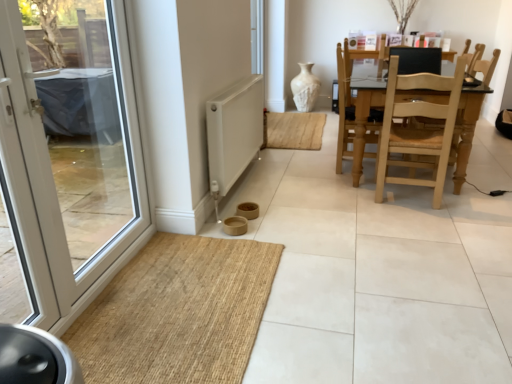
Image resolution: width=512 pixels, height=384 pixels. What do you see at coordinates (70, 151) in the screenshot?
I see `white glass door at left` at bounding box center [70, 151].

The height and width of the screenshot is (384, 512). Describe the element at coordinates (178, 312) in the screenshot. I see `brown woven mat at lower left` at that location.

In order to click on light wood/wooden chair at right in this screenshot , I will do `click(417, 128)`.

This screenshot has height=384, width=512. What are the coordinates of `white textured vase at center` in the screenshot? It's located at (305, 88).

This screenshot has height=384, width=512. Describe the element at coordinates (417, 60) in the screenshot. I see `black matte chair back at upper right` at that location.

This screenshot has height=384, width=512. Find the location of `white glass door at left`. white glass door at left is located at coordinates (70, 151).

Are light brown wooden swivel chair at center and white matte radiator at lower center far apart?

That's not correct — light brown wooden swivel chair at center is a little close to white matte radiator at lower center.

Is light brown wooden swivel chair at center closer to camera compared to white matte radiator at lower center?

No, it is not.

Is point (348, 60) in front of point (210, 121)?

No, (348, 60) is behind (210, 121).

Is light brown wooden swivel chair at center bigger or smaller than white matte radiator at lower center?

Clearly, light brown wooden swivel chair at center is larger in size than white matte radiator at lower center.

Is white glass door at left facing towards light wood/wooden chair at right?

No, white glass door at left is not aimed at light wood/wooden chair at right.

From a real-world perspective, which object stands above the other?

white glass door at left, from a real-world perspective.

Is white glass door at left closer to camera compared to light wood/wooden chair at right?

Yes, white glass door at left is in front of light wood/wooden chair at right.

Is light wood/wooden chair at right aimed at white textured vase at center?

No.

Is light wood/wooden chair at right not near white textured vase at center?

Yes.

Is light wood/wooden chair at right smaller than white textured vase at center?

No, light wood/wooden chair at right is not smaller than white textured vase at center.

Which object is wider, light wood/wooden chair at right or white textured vase at center?

With larger width is light wood/wooden chair at right.

From their relative heights in the image, would you say black matte chair back at upper right is taller or shorter than brown woven mat at lower left?

In the image, black matte chair back at upper right appears to be taller than brown woven mat at lower left.

Considering the positions of objects black matte chair back at upper right and brown woven mat at lower left in the image provided, who is in front, black matte chair back at upper right or brown woven mat at lower left?

Positioned in front is brown woven mat at lower left.

From the image's perspective, is black matte chair back at upper right located above or below brown woven mat at lower left?

black matte chair back at upper right is situated higher than brown woven mat at lower left in the image.

What are the coordinates of `chair located below the light brown wooden swivel chair at center (from the image's perspective)` in the screenshot? It's located at (417, 128).

Can you confirm if light brown wooden swivel chair at center is positioned to the right of light wood/wooden chair at right?

In fact, light brown wooden swivel chair at center is to the left of light wood/wooden chair at right.

How distant is light brown wooden swivel chair at center from light wood/wooden chair at right?

A distance of 40.32 centimeters exists between light brown wooden swivel chair at center and light wood/wooden chair at right.

Can you confirm if light brown wooden swivel chair at center is smaller than light wood/wooden chair at right?

Yes, light brown wooden swivel chair at center is smaller than light wood/wooden chair at right.

Is white textured vase at center wider or thinner than white matte radiator at lower center?

In the image, white textured vase at center appears to be wider than white matte radiator at lower center.

Is white textured vase at center not close to white matte radiator at lower center?

white textured vase at center is far away from white matte radiator at lower center.

From a real-world perspective, is white textured vase at center physically located above or below white matte radiator at lower center?

white textured vase at center is below white matte radiator at lower center.

Is white textured vase at center located outside white glass door at left?

Absolutely, white textured vase at center is external to white glass door at left.

Does point (300, 99) come behind point (42, 173)?

Yes, point (300, 99) is farther from viewer.

In terms of height, does white textured vase at center look taller or shorter compared to white glass door at left?

Clearly, white textured vase at center is shorter compared to white glass door at left.

Identify the location of swivel chair that appears on the right of white matte radiator at lower center. The width and height of the screenshot is (512, 384). (344, 104).

Locate an element on the screen. This screenshot has width=512, height=384. door that is on the left side of light wood/wooden chair at right is located at coordinates (70, 151).

Based on their spatial positions, is white matte radiator at lower center or light brown wooden swivel chair at center closer to white textured vase at center?

light brown wooden swivel chair at center is closer to white textured vase at center.

Based on their spatial positions, is black matte chair back at upper right or white textured vase at center further from light brown wooden swivel chair at center?

The object further to light brown wooden swivel chair at center is white textured vase at center.

When comparing their distances from white matte radiator at lower center, does light wood/wooden chair at right or light brown wooden swivel chair at center seem further?

light wood/wooden chair at right is further to white matte radiator at lower center.

Estimate the real-world distances between objects in this image. Which object is closer to black matte chair back at upper right, white glass door at left or white textured vase at center?

The object closer to black matte chair back at upper right is white textured vase at center.

From the image, which object appears to be farther from brown woven mat at lower left, white glass door at left or light wood/wooden chair at right?

light wood/wooden chair at right is further to brown woven mat at lower left.

From the image, which object appears to be nearer to white textured vase at center, black matte chair back at upper right or white glass door at left?

black matte chair back at upper right.

Which object lies further to the anchor point white matte radiator at lower center, light brown wooden swivel chair at center or white textured vase at center?

Based on the image, white textured vase at center appears to be further to white matte radiator at lower center.

From the image, which object appears to be nearer to light wood/wooden chair at right, light brown wooden swivel chair at center or white glass door at left?

light brown wooden swivel chair at center is positioned closer to the anchor light wood/wooden chair at right.

This screenshot has height=384, width=512. Find the location of `the back positioned between white matte radiator at lower center and white textured vase at center from near to far`. the back positioned between white matte radiator at lower center and white textured vase at center from near to far is located at coordinates (417, 60).

Find the location of `the back positioned between light wood/wooden chair at right and light brown wooden swivel chair at center from near to far`. the back positioned between light wood/wooden chair at right and light brown wooden swivel chair at center from near to far is located at coordinates (417, 60).

The image size is (512, 384). What are the coordinates of `radiator located between white glass door at left and light brown wooden swivel chair at center in the depth direction` in the screenshot? It's located at (233, 133).

This screenshot has width=512, height=384. I want to click on radiator between white glass door at left and black matte chair back at upper right from left to right, so click(x=233, y=133).